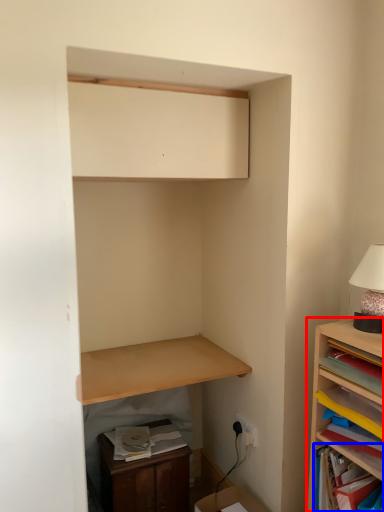
Question: Which point is closer to the camera, shelf (highlighted by a red box) or shelf (highlighted by a blue box)?

Choices:
 (A) shelf
 (B) shelf

Answer: (A)